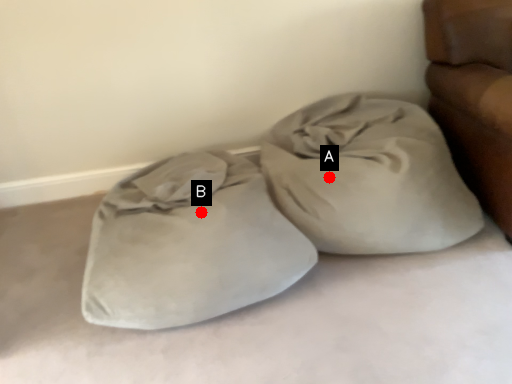
Question: Two points are circled on the image, labeled by A and B beside each circle. Among these points, which one is farthest from the camera?

Choices:
 (A) A is further
 (B) B is further

Answer: (A)